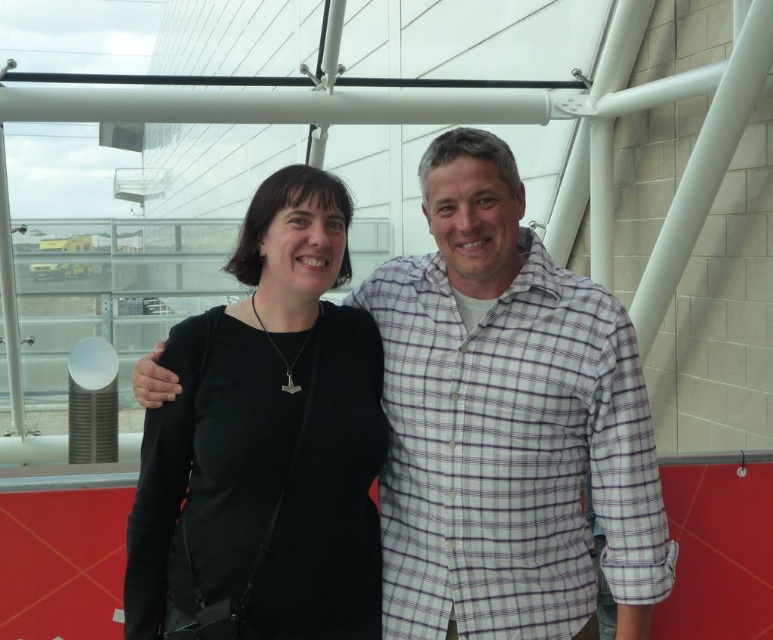
You are standing in front of the two people in the image. There are two points marked in the scene. Which point, point (663, 570) or point (172, 561), is closer to you?

Point (663, 570) is closer to you than point (172, 561).